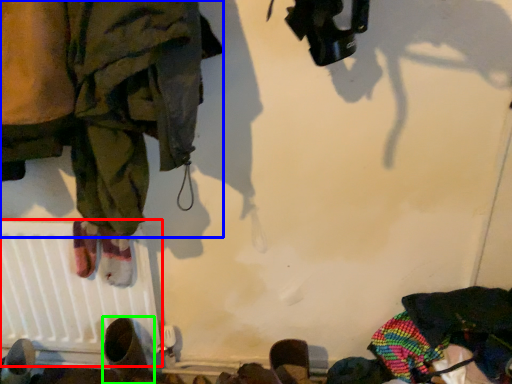
Question: Which object is the closest to the radiator (highlighted by a red box)? Choose among these: clothing (highlighted by a blue box) or footwear (highlighted by a green box).

Choices:
 (A) clothing
 (B) footwear

Answer: (B)